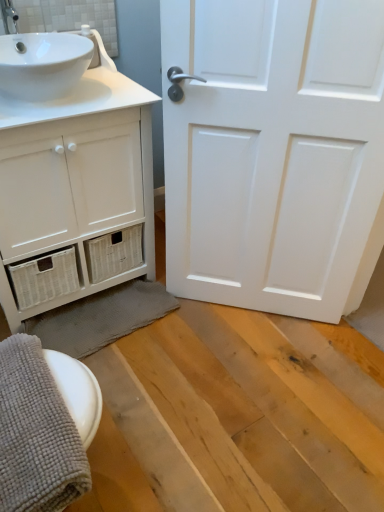
Question: Based on their positions, is gray textured bath towel at lower left, which is counted as the second bath towel, starting from the front, located to the left or right of gray textured bath towel at lower left, which is the first bath towel in front-to-back order?

Choices:
 (A) right
 (B) left

Answer: (A)

Question: From the image's perspective, relative to gray textured bath towel at lower left, which is the first bath towel in front-to-back order, is gray textured bath towel at lower left, which is counted as the second bath towel, starting from the front, above or below?

Choices:
 (A) above
 (B) below

Answer: (A)

Question: Which of these objects is positioned closest to the gray textured bath towel at lower left, which is the first bath towel in front-to-back order?

Choices:
 (A) white glossy sink at upper left
 (B) white matte door at center
 (C) gray textured bath towel at lower left, which is counted as the second bath towel, starting from the front
 (D) white matte cabinet at left

Answer: (D)

Question: Estimate the real-world distances between objects in this image. Which object is closer to the white matte cabinet at left?

Choices:
 (A) white matte door at center
 (B) white glossy sink at upper left
 (C) gray textured bath towel at lower left, which is counted as the second bath towel, starting from the front
 (D) gray textured bath towel at lower left, which is the first bath towel in front-to-back order

Answer: (B)